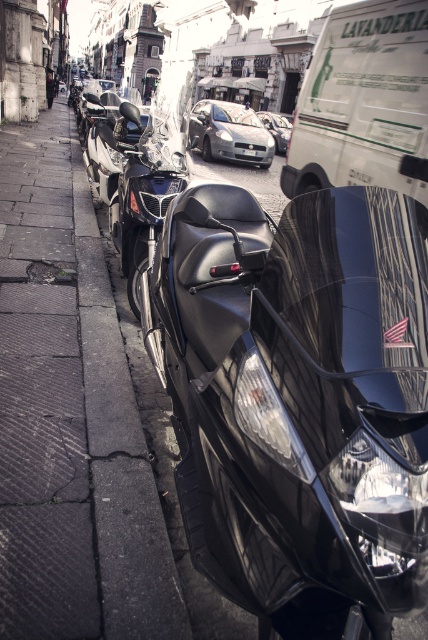
Consider the image. Which is below, glossy black motorcycle at center or dark concrete pavement at left?

glossy black motorcycle at center is lower down.

Can you confirm if glossy black motorcycle at center is positioned to the left of dark concrete pavement at left?

No, glossy black motorcycle at center is not to the left of dark concrete pavement at left.

Does point (171, 268) come behind point (41, 328)?

No, (171, 268) is closer to viewer.

Image resolution: width=428 pixels, height=640 pixels. What are the coordinates of `glossy black motorcycle at center` in the screenshot? It's located at (297, 401).

Between glossy black motorcycle at center and shiny silver sports car at center, which one appears on the left side from the viewer's perspective?

glossy black motorcycle at center is more to the left.

Is glossy black motorcycle at center positioned at the back of shiny silver sports car at center?

No.

The height and width of the screenshot is (640, 428). What do you see at coordinates (297, 401) in the screenshot?
I see `glossy black motorcycle at center` at bounding box center [297, 401].

Find the location of a particular element. glossy black motorcycle at center is located at coordinates (297, 401).

Who is shorter, dark concrete pavement at left or satin silver car at center?

With less height is satin silver car at center.

Is dark concrete pavement at left closer to the viewer compared to satin silver car at center?

That is True.

The image size is (428, 640). I want to click on dark concrete pavement at left, so click(x=71, y=417).